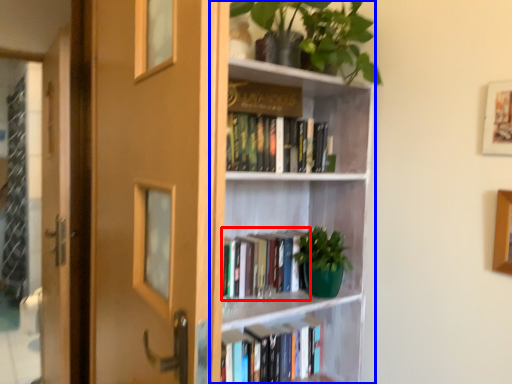
Question: Which point is further to the camera, book (highlighted by a red box) or bookcase (highlighted by a blue box)?

Choices:
 (A) book
 (B) bookcase

Answer: (A)